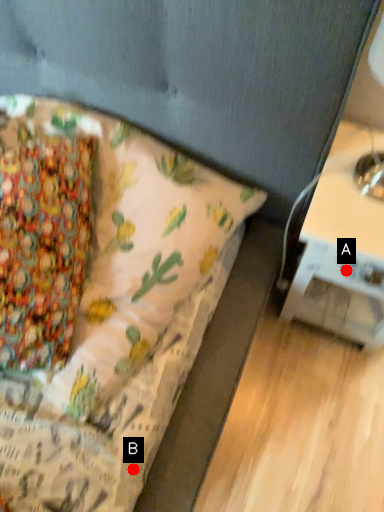
Question: Two points are circled on the image, labeled by A and B beside each circle. Which point appears farthest from the camera in this image?

Choices:
 (A) A is further
 (B) B is further

Answer: (A)